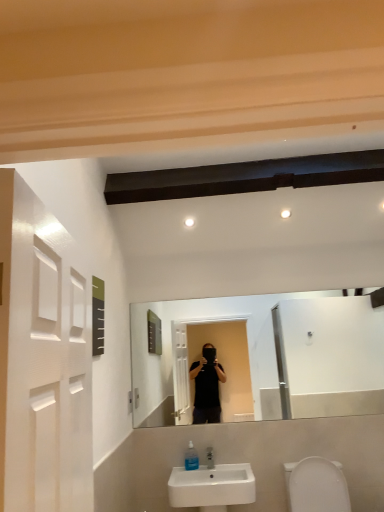
Question: Considering the relative sizes of white ceramic sink at lower center and white glossy toilet bowl at lower right in the image provided, is white ceramic sink at lower center wider than white glossy toilet bowl at lower right?

Choices:
 (A) yes
 (B) no

Answer: (B)

Question: Would you consider white ceramic sink at lower center to be distant from white glossy toilet bowl at lower right?

Choices:
 (A) yes
 (B) no

Answer: (B)

Question: Can you confirm if white ceramic sink at lower center is bigger than white glossy toilet bowl at lower right?

Choices:
 (A) no
 (B) yes

Answer: (A)

Question: Is white ceramic sink at lower center taller than white glossy toilet bowl at lower right?

Choices:
 (A) yes
 (B) no

Answer: (A)

Question: Considering the relative sizes of white ceramic sink at lower center and white glossy toilet bowl at lower right in the image provided, is white ceramic sink at lower center shorter than white glossy toilet bowl at lower right?

Choices:
 (A) no
 (B) yes

Answer: (A)

Question: Considering the positions of white glossy toilet bowl at lower right and white ceramic sink at lower center in the image, is white glossy toilet bowl at lower right taller or shorter than white ceramic sink at lower center?

Choices:
 (A) short
 (B) tall

Answer: (A)

Question: Do you think white glossy toilet bowl at lower right is within white ceramic sink at lower center, or outside of it?

Choices:
 (A) outside
 (B) inside

Answer: (A)

Question: From a real-world perspective, is white glossy toilet bowl at lower right positioned above or below white ceramic sink at lower center?

Choices:
 (A) below
 (B) above

Answer: (A)

Question: Based on their positions, is white glossy toilet bowl at lower right located to the left or right of white ceramic sink at lower center?

Choices:
 (A) right
 (B) left

Answer: (A)

Question: Is point (324, 481) positioned closer to the camera than point (192, 451)?

Choices:
 (A) farther
 (B) closer

Answer: (B)

Question: In the image, is white glossy toilet bowl at lower right positioned in front of or behind transparent plastic soap dispenser at lower center?

Choices:
 (A) front
 (B) behind

Answer: (A)

Question: Choose the correct answer: Is white glossy toilet bowl at lower right inside transparent plastic soap dispenser at lower center or outside it?

Choices:
 (A) inside
 (B) outside

Answer: (B)

Question: In terms of height, does white glossy toilet bowl at lower right look taller or shorter compared to transparent plastic soap dispenser at lower center?

Choices:
 (A) tall
 (B) short

Answer: (A)

Question: In terms of size, does transparent plastic soap dispenser at lower center appear bigger or smaller than white glossy toilet bowl at lower right?

Choices:
 (A) small
 (B) big

Answer: (A)

Question: Visually, is transparent plastic soap dispenser at lower center positioned to the left or to the right of white glossy toilet bowl at lower right?

Choices:
 (A) left
 (B) right

Answer: (A)